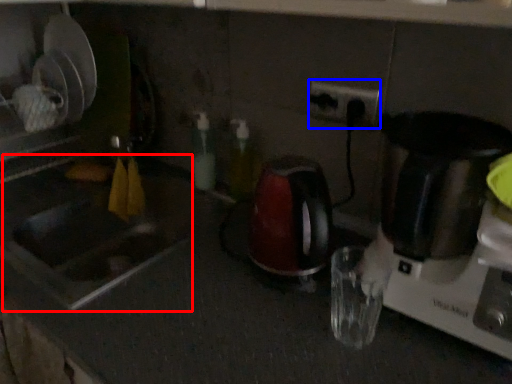
Question: Among these objects, which one is farthest to the camera, sink (highlighted by a red box) or electric outlet (highlighted by a blue box)?

Choices:
 (A) sink
 (B) electric outlet

Answer: (B)